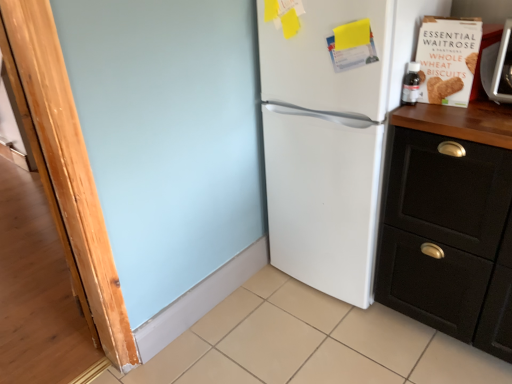
Question: In the image, is beige tile at lower center positioned in front of or behind white matte refrigerator at center?

Choices:
 (A) behind
 (B) front

Answer: (B)

Question: Based on their sizes in the image, would you say beige tile at lower center is bigger or smaller than white matte refrigerator at center?

Choices:
 (A) big
 (B) small

Answer: (B)

Question: Which object is positioned farthest from the white matte refrigerator at center?

Choices:
 (A) black matte cabinet at right
 (B) beige tile at lower center

Answer: (B)

Question: Which of these objects is positioned farthest from the beige tile at lower center?

Choices:
 (A) white matte refrigerator at center
 (B) black matte cabinet at right

Answer: (A)